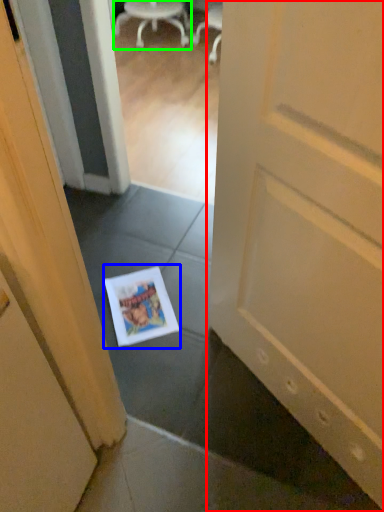
Question: Considering the real-world distances, which object is closest to door (highlighted by a red box)? magazine (highlighted by a blue box) or chair (highlighted by a green box).

Choices:
 (A) magazine
 (B) chair

Answer: (A)